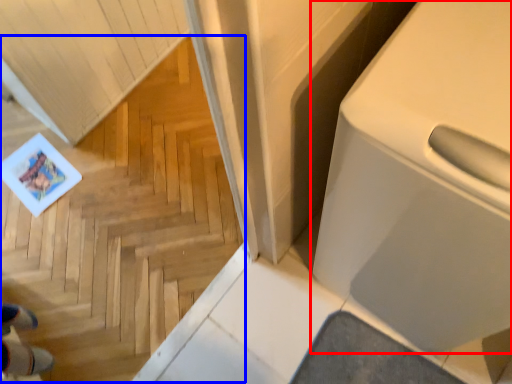
Question: Among these objects, which one is farthest to the camera, home appliance (highlighted by a red box) or stairwell (highlighted by a blue box)?

Choices:
 (A) home appliance
 (B) stairwell

Answer: (A)